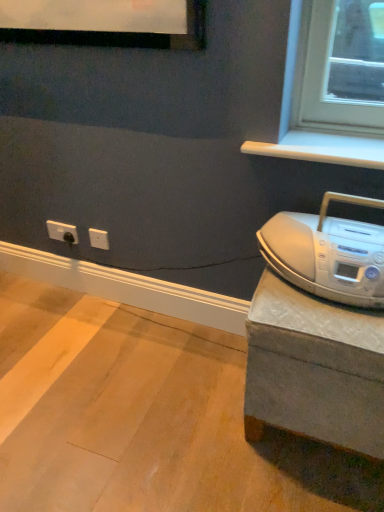
Question: Relative to silver metallic boombox at right, is gray concrete at right in front or behind?

Choices:
 (A) front
 (B) behind

Answer: (A)

Question: Is point (173, 401) closer or farther from the camera than point (377, 224)?

Choices:
 (A) farther
 (B) closer

Answer: (A)

Question: Estimate the real-world distances between objects in this image. Which object is farther from the white plastic outlet at lower left?

Choices:
 (A) gray concrete at right
 (B) silver metallic boombox at right

Answer: (B)

Question: Considering the real-world distances, which object is closest to the silver metallic boombox at right?

Choices:
 (A) white plastic outlet at lower left
 (B) gray concrete at right

Answer: (B)